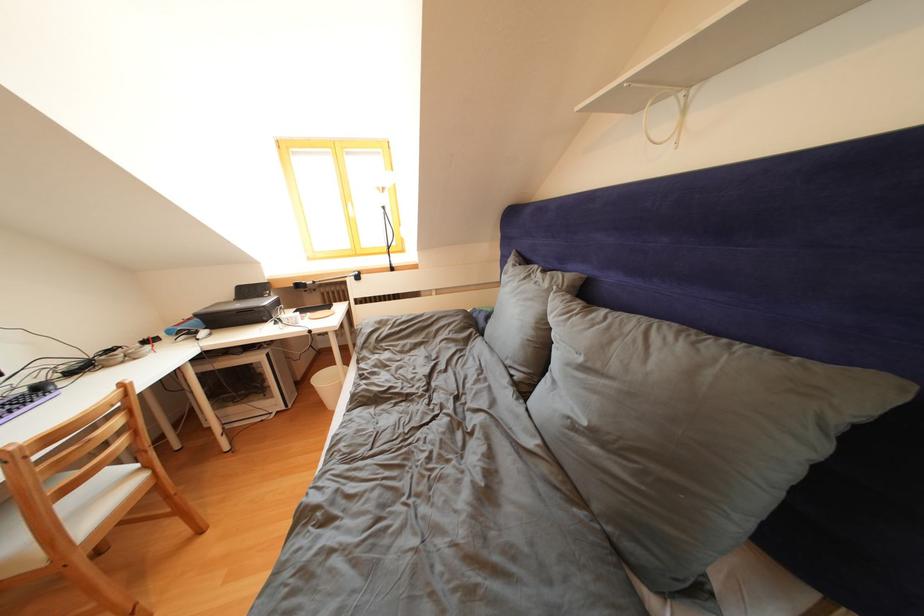
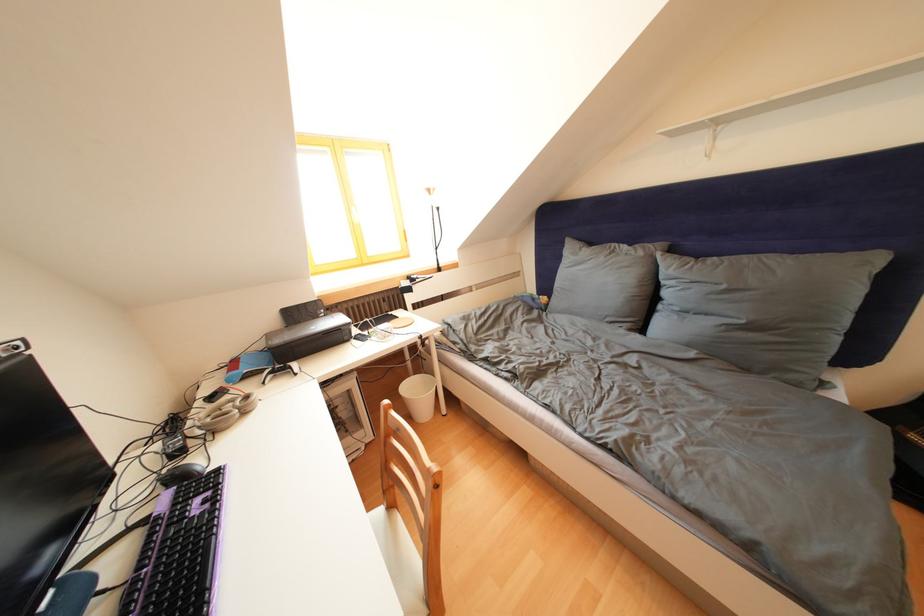
In the second image, find the point that corresponds to [153,347] in the first image.

(220, 403)